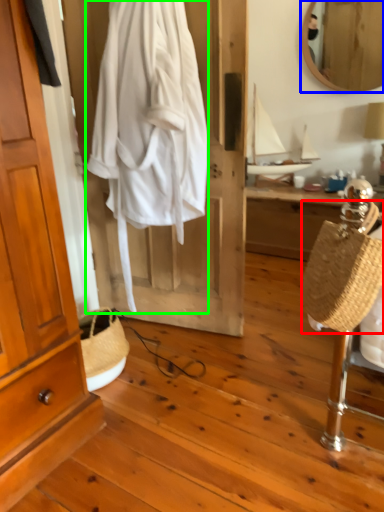
Question: Which object is the closest to the handbag (highlighted by a red box)? Choose among these: mirror (highlighted by a blue box) or clothing (highlighted by a green box).

Choices:
 (A) mirror
 (B) clothing

Answer: (B)